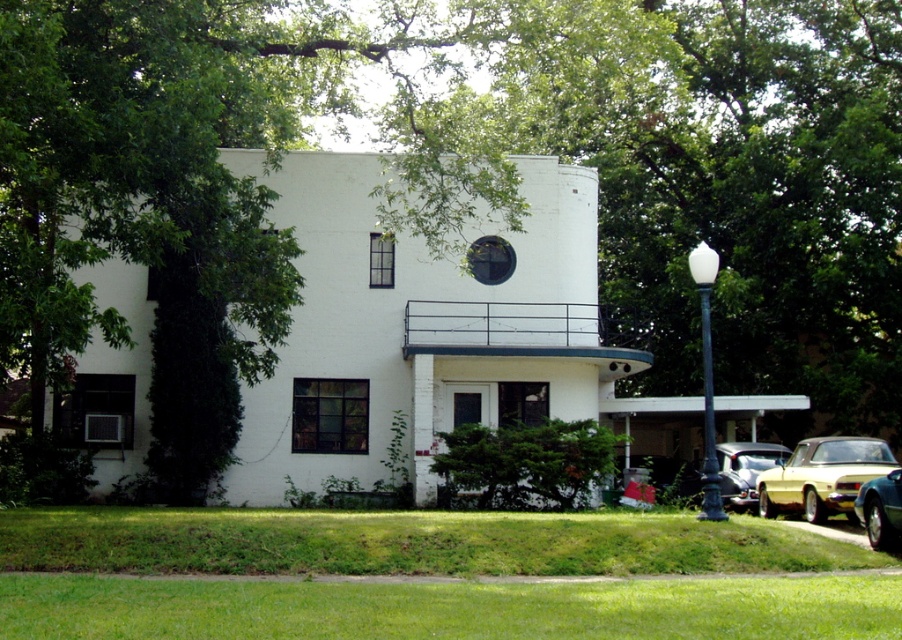
Question: Which of the following is the farthest from the observer?

Choices:
 (A) metallic gold car at lower right
 (B) shiny silver car at lower right
 (C) gold metallic convertible at lower right

Answer: (B)

Question: Which of the following is the farthest from the observer?

Choices:
 (A) green leafy tree at center
 (B) shiny silver car at lower right

Answer: (B)

Question: Which object appears closest to the camera in this image?

Choices:
 (A) green leafy tree at center
 (B) shiny silver car at lower right
 (C) gold metallic convertible at lower right

Answer: (A)

Question: Is green leafy tree at center smaller than shiny silver car at lower right?

Choices:
 (A) no
 (B) yes

Answer: (A)

Question: Does gold metallic convertible at lower right lie in front of shiny silver car at lower right?

Choices:
 (A) yes
 (B) no

Answer: (A)

Question: Is the position of green leafy tree at center less distant than that of shiny silver car at lower right?

Choices:
 (A) no
 (B) yes

Answer: (B)